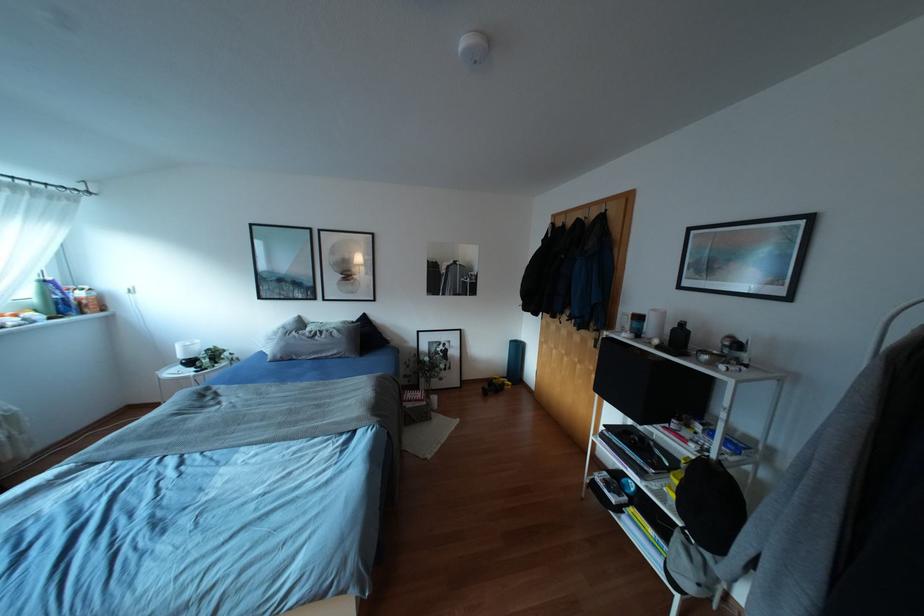
Which object does [43,296] point to?

It corresponds to the green water bottle in the image.